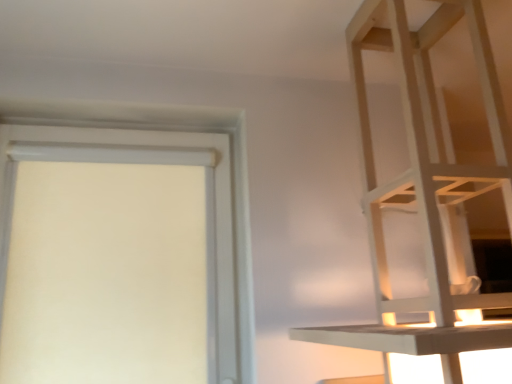
Question: From a real-world perspective, is white matte door at left positioned above or below white wood shelf at upper right?

Choices:
 (A) above
 (B) below

Answer: (B)

Question: Is white matte door at left inside or outside of white wood shelf at upper right?

Choices:
 (A) inside
 (B) outside

Answer: (B)

Question: Is white matte door at left in front of or behind white wood shelf at upper right in the image?

Choices:
 (A) front
 (B) behind

Answer: (B)

Question: Looking at the image, does white wood shelf at upper right seem bigger or smaller compared to white matte door at left?

Choices:
 (A) big
 (B) small

Answer: (A)

Question: Is point (504, 117) closer or farther from the camera than point (157, 114)?

Choices:
 (A) closer
 (B) farther

Answer: (A)

Question: From the image's perspective, is white wood shelf at upper right above or below white matte door at left?

Choices:
 (A) below
 (B) above

Answer: (B)

Question: Is white wood shelf at upper right taller or shorter than white matte door at left?

Choices:
 (A) short
 (B) tall

Answer: (B)